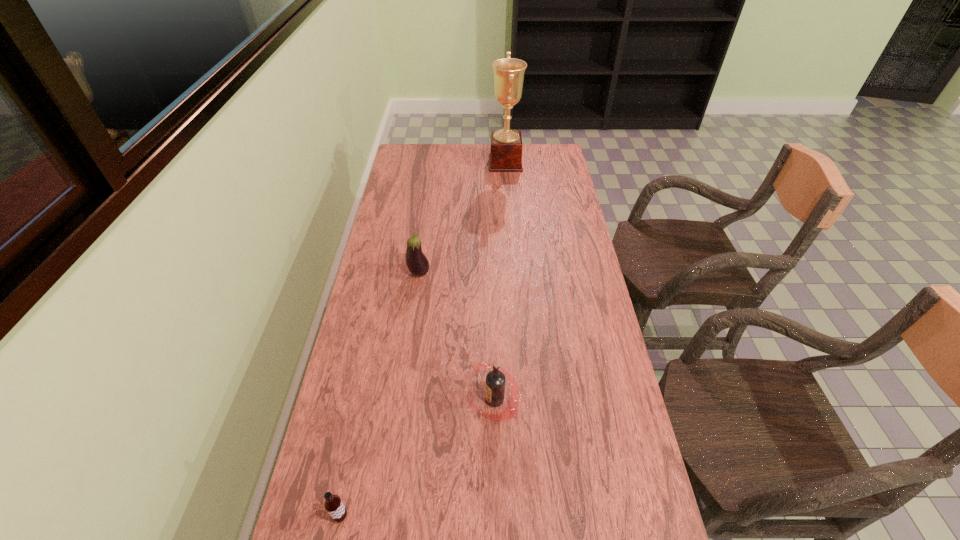
Find the location of a particular element. This screenshot has width=960, height=540. vacant space positioned on the plaque of the tallest object is located at coordinates (451, 163).

Locate an element on the screen. Image resolution: width=960 pixels, height=540 pixels. blank space located on the right of the eggplant is located at coordinates (471, 273).

You are a GUI agent. You are given a task and a screenshot of the screen. Output one action in this format:
    pyautogui.click(x=<x>, y=<y>)
    Task: Click on the free space located 0.190m on the label of the second nearest object
    The height and width of the screenshot is (540, 960).
    Given the screenshot: What is the action you would take?
    pyautogui.click(x=396, y=400)

I want to click on free region located 0.240m on the label of the second nearest object, so click(x=376, y=400).

In order to click on free point located 0.090m on the label of the second nearest object in this screenshot , I will do `click(434, 400)`.

Identify the location of free space located 0.070m on the right of the leftmost object. This screenshot has width=960, height=540. (381, 516).

Where is `object located at the far edge`? object located at the far edge is located at coordinates (506, 146).

At what (x,y) coordinates should I click in order to perform the action: click on eggplant present at the left edge. Please return your answer as a coordinate pair (x, y). This screenshot has height=540, width=960. Looking at the image, I should click on (417, 263).

The height and width of the screenshot is (540, 960). What are the coordinates of `root beer that is at the left edge` in the screenshot? It's located at [x=333, y=505].

In the image, there is a desktop. Where is `blank space at the far edge`? The width and height of the screenshot is (960, 540). blank space at the far edge is located at coordinates (435, 153).